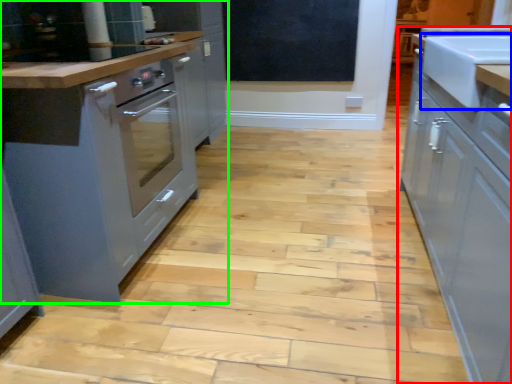
Question: Which is nearer to the cabinetry (highlighted by a red box)? sink (highlighted by a blue box) or cabinetry (highlighted by a green box).

Choices:
 (A) sink
 (B) cabinetry

Answer: (A)